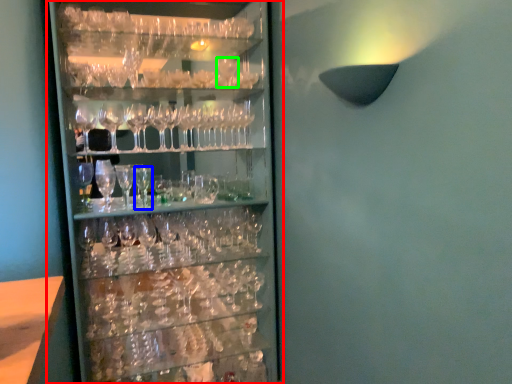
Question: Which is farther away from shelf (highlighted by a red box)? beer glass (highlighted by a blue box) or wine glass (highlighted by a green box)?

Choices:
 (A) beer glass
 (B) wine glass

Answer: (B)